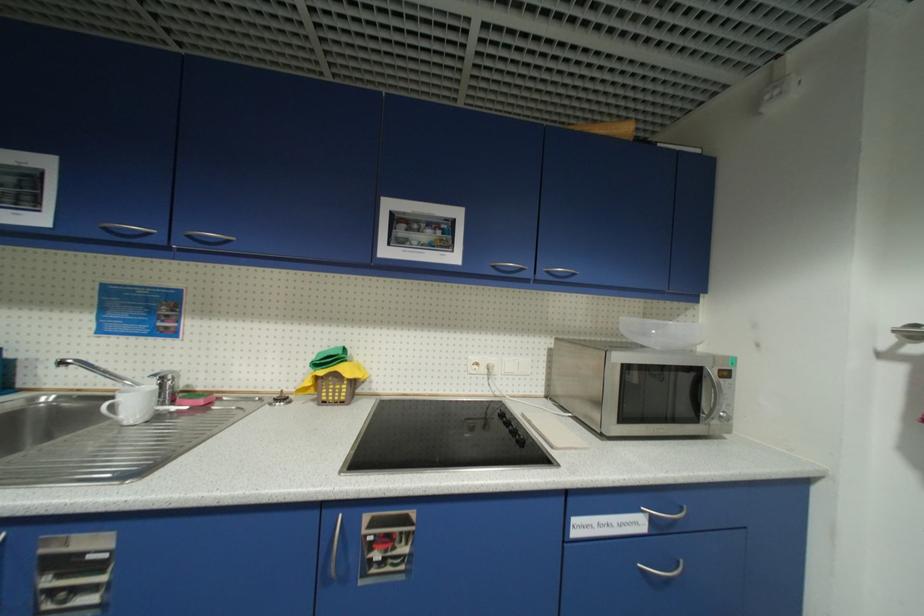
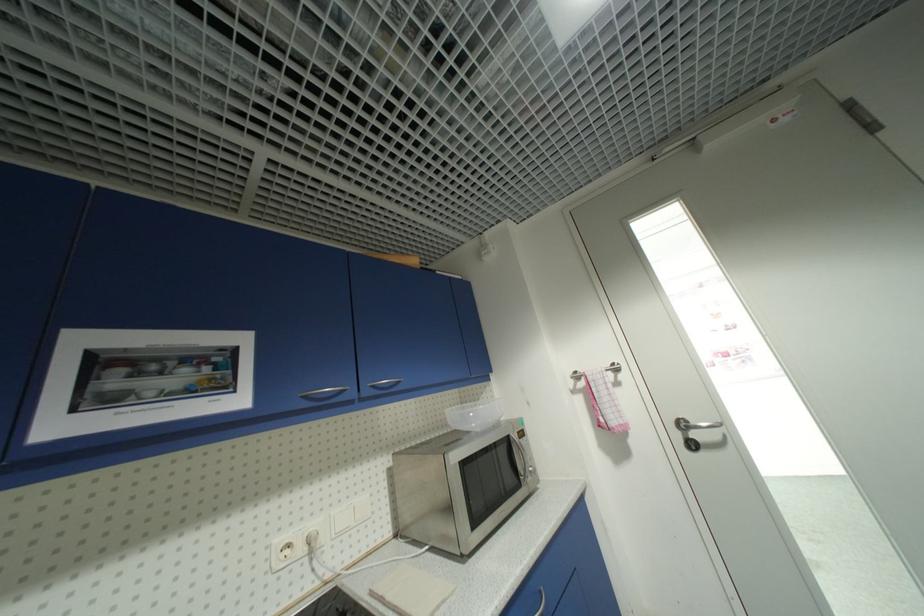
Where in the second image is the point corresponding to point (529, 416) from the first image?

(378, 594)